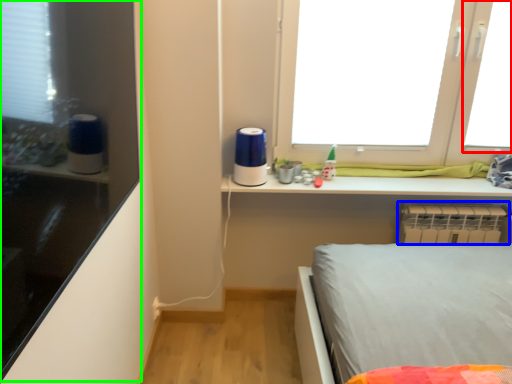
Question: Based on their relative distances, which object is farther from window screen (highlighted by a red box)? Choose from radiator (highlighted by a blue box) and shelf (highlighted by a green box).

Choices:
 (A) radiator
 (B) shelf

Answer: (B)